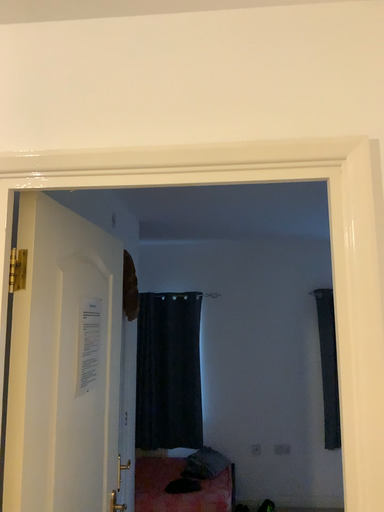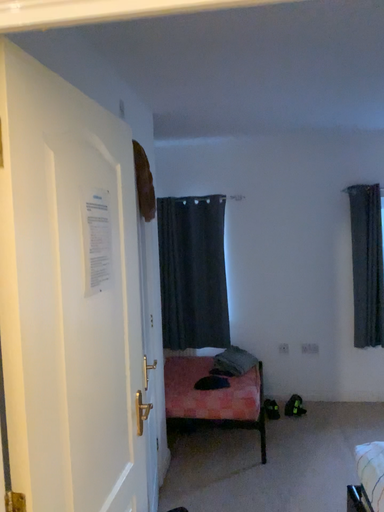
Question: How did the camera likely rotate when shooting the video?

Choices:
 (A) rotated downward
 (B) rotated upward

Answer: (A)